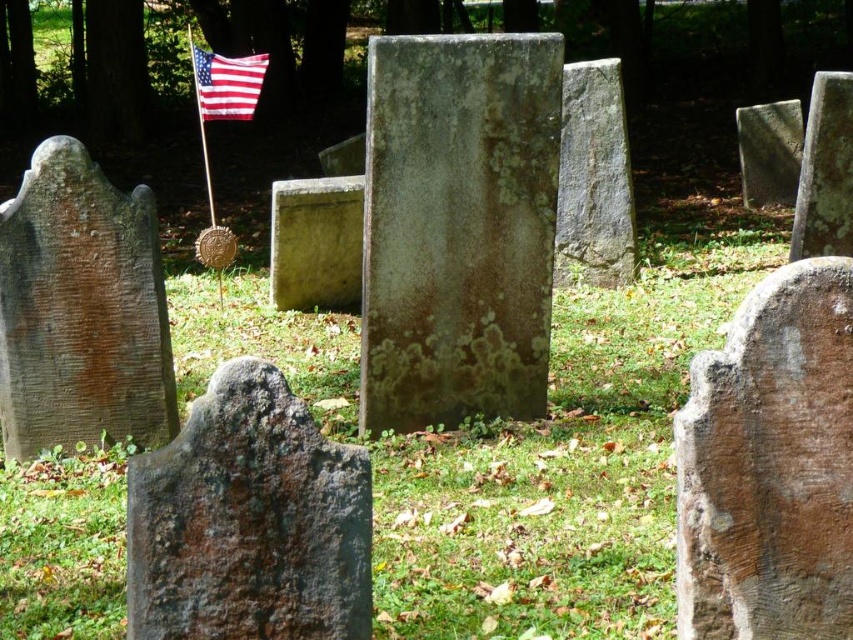
Is point (694, 588) closer to camera compared to point (247, 64)?

Yes, point (694, 588) is in front of point (247, 64).

Who is more distant from viewer, (848, 396) or (247, 58)?

The point (247, 58) is behind.

The image size is (853, 640). Describe the element at coordinates (770, 465) in the screenshot. I see `brown rough stone gravestone at right` at that location.

You are a GUI agent. You are given a task and a screenshot of the screen. Output one action in this format:
    pyautogui.click(x=<x>, y=<y>)
    Task: Click on the brown rough stone gravestone at right
    This screenshot has height=640, width=853.
    Given the screenshot: What is the action you would take?
    pyautogui.click(x=770, y=465)

Which is in front, point (126, 292) or point (573, 154)?

Positioned in front is point (126, 292).

Which is behind, point (74, 195) or point (608, 284)?

The point (608, 284) is behind.

Find the location of a particular element. Image resolution: width=853 pixels, height=640 pixels. brown stone gravestone at left is located at coordinates (80, 310).

Based on the photo, does rusty stone gravestone at center appear under gray stone gravestone at center?

Yes.

Is rusty stone gravestone at center taller than gray stone gravestone at center?

No, rusty stone gravestone at center is not taller than gray stone gravestone at center.

Where is `rusty stone gravestone at center`? rusty stone gravestone at center is located at coordinates (248, 522).